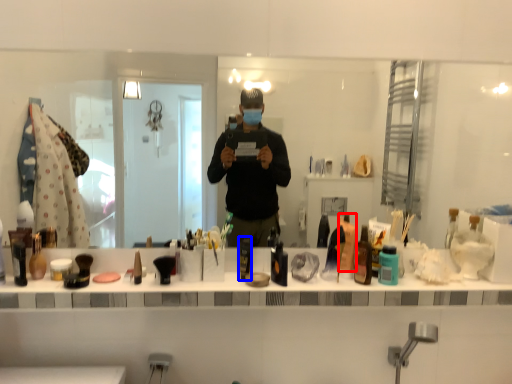
Question: Which object is further to the camera taking this photo, toiletry (highlighted by a red box) or toiletry (highlighted by a blue box)?

Choices:
 (A) toiletry
 (B) toiletry

Answer: (A)